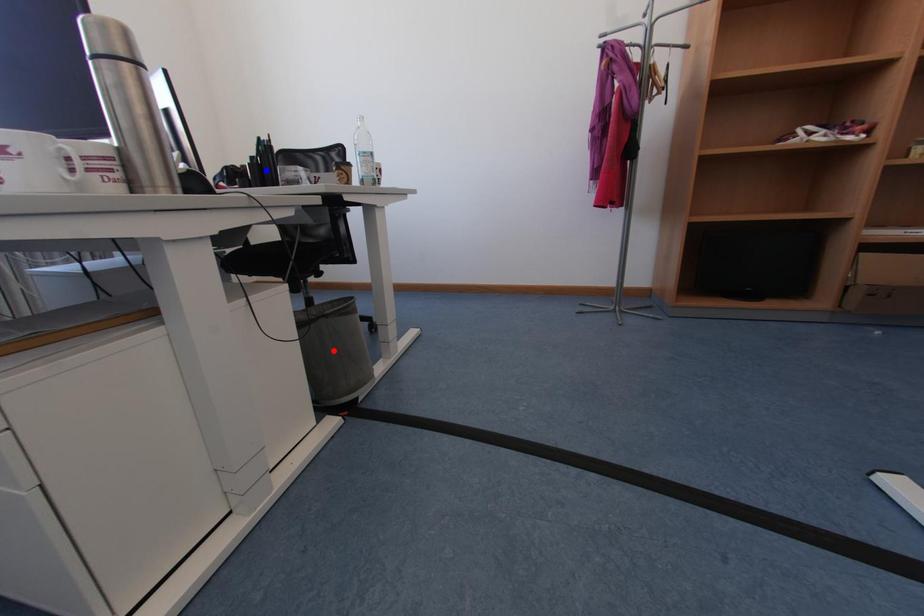
Question: In the image, two points are highlighted. Which point is nearer to the camera? Reply with the corresponding letter.

Choices:
 (A) blue point
 (B) red point

Answer: (A)